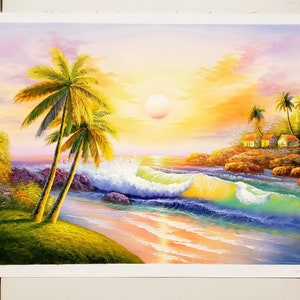
The width and height of the screenshot is (300, 300). I want to click on table behind the painting, so tap(35, 6), tap(145, 8), tap(261, 9), tap(123, 290), tap(43, 291), tap(204, 289), tap(280, 286).